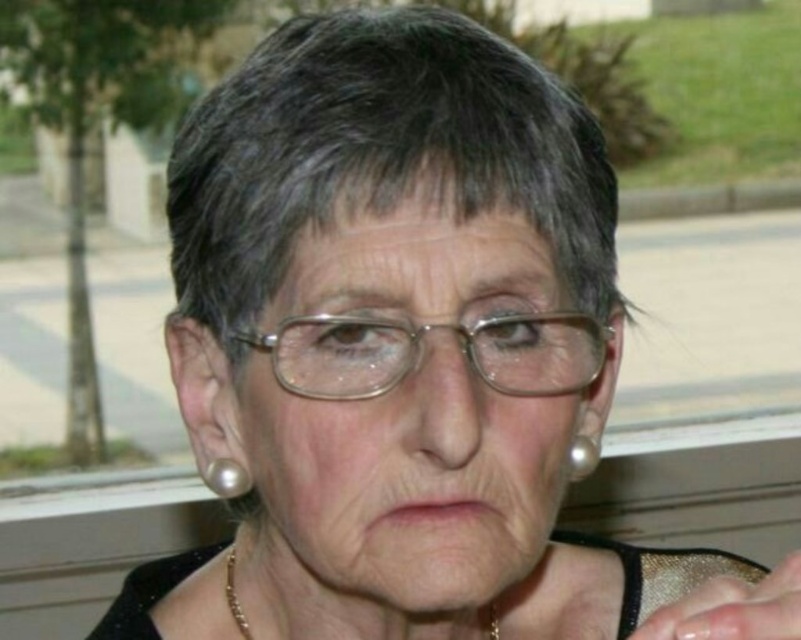
Is clear plastic glasses at center positioned before pearlelegantearring at lower left?

Yes, clear plastic glasses at center is closer to the viewer.

Is point (522, 312) more distant than point (235, 474)?

No.

The height and width of the screenshot is (640, 801). I want to click on clear plastic glasses at center, so click(x=419, y=353).

Does pearlelegantearring at lower left have a lesser width compared to gold chain at lower center?

Indeed, pearlelegantearring at lower left has a lesser width compared to gold chain at lower center.

How much distance is there between pearlelegantearring at lower left and gold chain at lower center?

A distance of 3.38 inches exists between pearlelegantearring at lower left and gold chain at lower center.

Does point (211, 460) lie in front of point (489, 604)?

Yes, it is in front of point (489, 604).

The height and width of the screenshot is (640, 801). What are the coordinates of `pearlelegantearring at lower left` in the screenshot? It's located at (226, 477).

Does gold chain at lower center appear on the right side of pearlelegantearring at upper right?

No, gold chain at lower center is not to the right of pearlelegantearring at upper right.

Is point (230, 573) farther from camera compared to point (572, 445)?

Yes, it is.

Measure the distance between point (490, 620) and camera.

Point (490, 620) and camera are 22.24 inches apart.

Find the location of `gold chain at lower center`. gold chain at lower center is located at coordinates (234, 595).